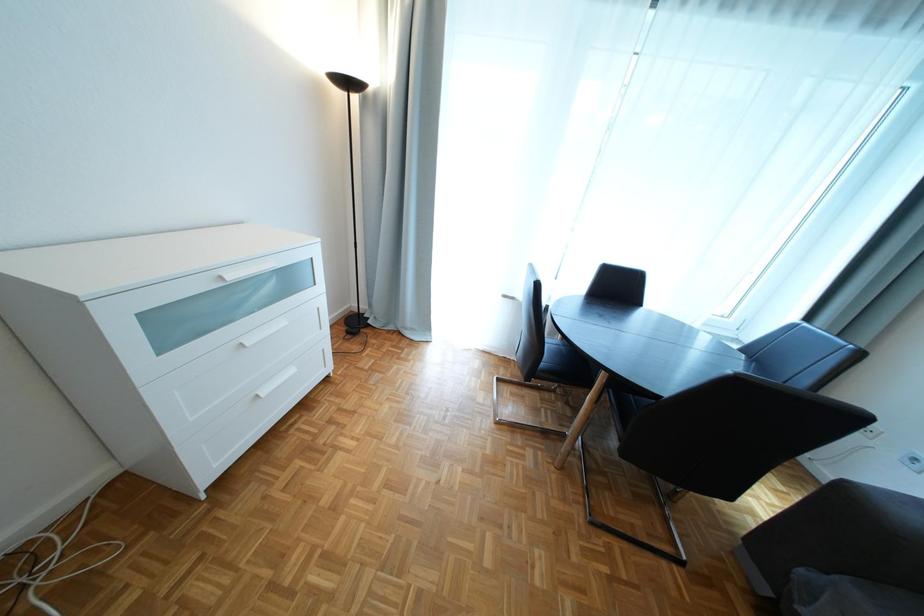
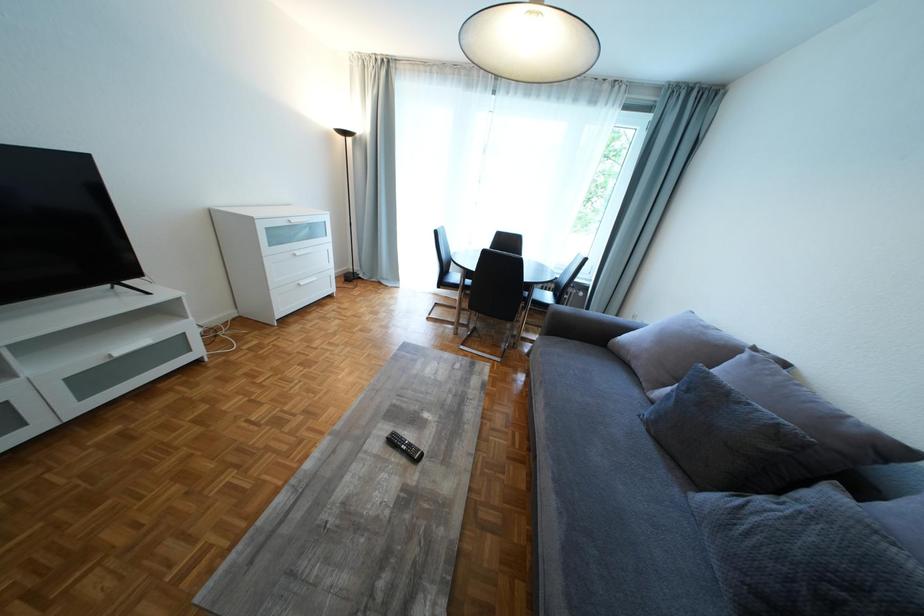
Which direction would the cameraman need to move to produce the second image?

The cameraman walked toward right, backward.